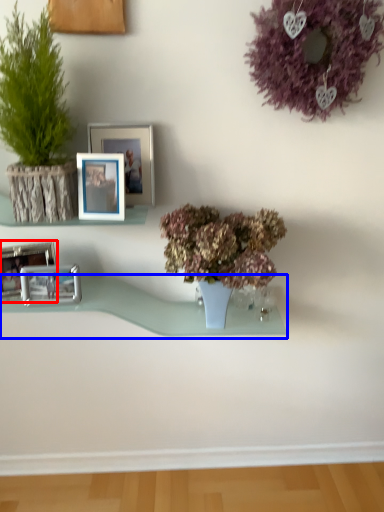
Question: Which of the following is the farthest to the observer, picture frame (highlighted by a red box) or window sill (highlighted by a blue box)?

Choices:
 (A) picture frame
 (B) window sill

Answer: (B)